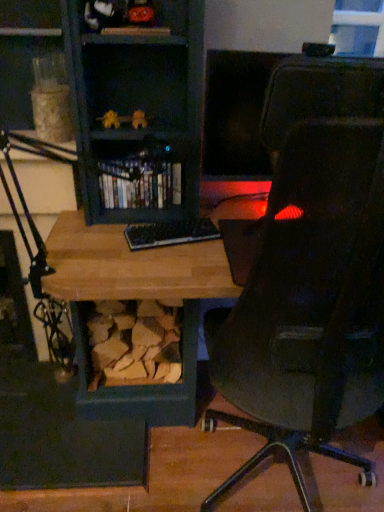
You are a GUI agent. You are given a task and a screenshot of the screen. Output one action in this format:
    pyautogui.click(x=<x>, y=<y>)
    Task: Click on the free location in front of black plastic keyboard at center
    Image resolution: width=384 pixels, height=512 pixels.
    Given the screenshot: What is the action you would take?
    pyautogui.click(x=167, y=267)